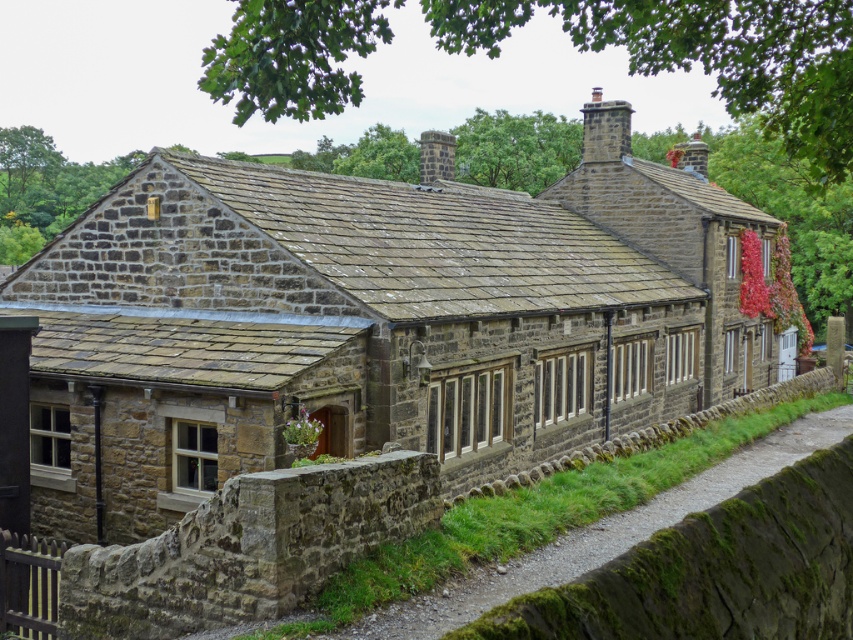
Question: Which object appears farthest from the camera in this image?

Choices:
 (A) rustic stone cottage at center
 (B) mossy stone path at lower center

Answer: (A)

Question: From the image, what is the correct spatial relationship of rustic stone cottage at center in relation to mossy stone path at lower center?

Choices:
 (A) left
 (B) right

Answer: (B)

Question: Which point appears farthest from the camera in this image?

Choices:
 (A) (396, 611)
 (B) (160, 308)

Answer: (B)

Question: Is rustic stone cottage at center below mossy stone path at lower center?

Choices:
 (A) no
 (B) yes

Answer: (A)

Question: Does rustic stone cottage at center appear on the left side of mossy stone path at lower center?

Choices:
 (A) no
 (B) yes

Answer: (A)

Question: Among these objects, which one is farthest from the camera?

Choices:
 (A) mossy stone path at lower center
 (B) rustic stone cottage at center

Answer: (B)